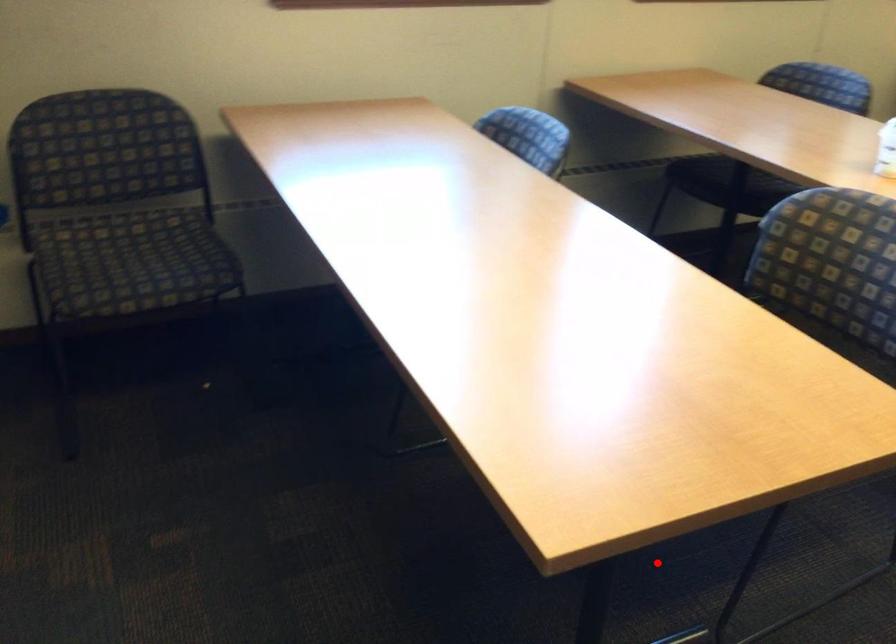
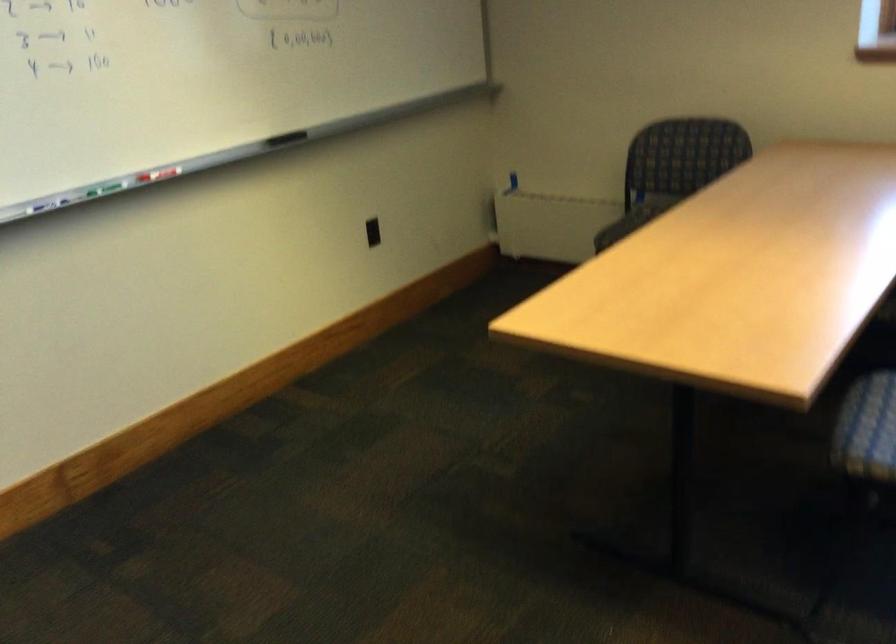
Find the pixel in the second image that matches the highlighted location in the first image.

(866, 576)